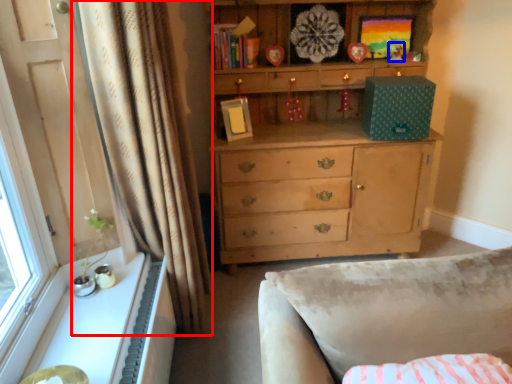
Question: Which object appears closest to the camera in this image, curtain (highlighted by a red box) or toy (highlighted by a blue box)?

Choices:
 (A) curtain
 (B) toy

Answer: (A)